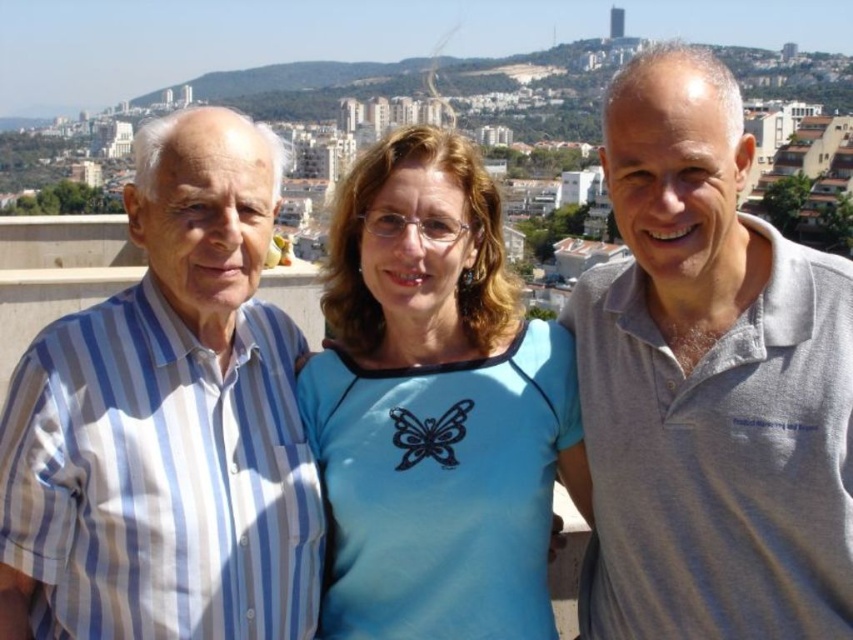
Who is positioned more to the left, gray cotton polo shirt at right or blue fabric shirt at center?

Positioned to the left is blue fabric shirt at center.

Measure the distance between gray cotton polo shirt at right and camera.

The distance of gray cotton polo shirt at right from camera is 49.81 meters.

Locate an element on the screen. gray cotton polo shirt at right is located at coordinates (709, 385).

The width and height of the screenshot is (853, 640). Find the location of `gray cotton polo shirt at right`. gray cotton polo shirt at right is located at coordinates (709, 385).

Is blue striped shirt at left thinner than blue fabric shirt at center?

No.

Who is higher up, blue striped shirt at left or blue fabric shirt at center?

Positioned higher is blue striped shirt at left.

Where is `blue striped shirt at left`? Image resolution: width=853 pixels, height=640 pixels. blue striped shirt at left is located at coordinates (167, 422).

Does gray cotton polo shirt at right have a smaller size compared to blue striped shirt at left?

Correct, gray cotton polo shirt at right occupies less space than blue striped shirt at left.

Where is `gray cotton polo shirt at right`? gray cotton polo shirt at right is located at coordinates (709, 385).

Who is more forward, (668,74) or (154,492)?

Positioned in front is point (154,492).

I want to click on gray cotton polo shirt at right, so click(709, 385).